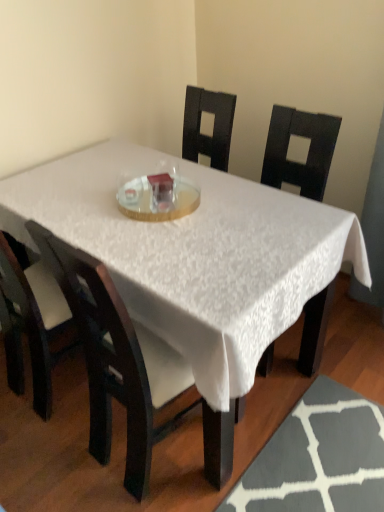
Question: Is matte black chair at center, the first chair when ordered from right to left, next to clear glass plate at center?

Choices:
 (A) yes
 (B) no

Answer: (B)

Question: Considering the relative positions of matte black chair at center, acting as the 2th chair starting from the left, and clear glass plate at center in the image provided, is matte black chair at center, acting as the 2th chair starting from the left, to the right of clear glass plate at center from the viewer's perspective?

Choices:
 (A) no
 (B) yes

Answer: (A)

Question: From a real-world perspective, is matte black chair at center, the first chair when ordered from right to left, physically below clear glass plate at center?

Choices:
 (A) no
 (B) yes

Answer: (B)

Question: Is matte black chair at center, acting as the 2th chair starting from the left, behind clear glass plate at center?

Choices:
 (A) no
 (B) yes

Answer: (A)

Question: Does matte black chair at center, acting as the 2th chair starting from the left, have a greater width compared to clear glass plate at center?

Choices:
 (A) yes
 (B) no

Answer: (A)

Question: Is clear glass plate at center surrounded by matte black chair at center, acting as the 2th chair starting from the left?

Choices:
 (A) yes
 (B) no

Answer: (B)

Question: Is matte black chair at center, the first chair when ordered from right to left, wider than matte black chair at center, positioned as the 2th chair in right-to-left order?

Choices:
 (A) no
 (B) yes

Answer: (B)

Question: Can you confirm if matte black chair at center, acting as the 2th chair starting from the left, is smaller than matte black chair at center, which is the 1th chair from left to right?

Choices:
 (A) no
 (B) yes

Answer: (A)

Question: Is matte black chair at center, acting as the 2th chair starting from the left, far from matte black chair at center, which is the 1th chair from left to right?

Choices:
 (A) no
 (B) yes

Answer: (A)

Question: From the image's perspective, would you say matte black chair at center, acting as the 2th chair starting from the left, is positioned over matte black chair at center, positioned as the 2th chair in right-to-left order?

Choices:
 (A) no
 (B) yes

Answer: (A)

Question: Is matte black chair at center, acting as the 2th chair starting from the left, at the left side of matte black chair at center, positioned as the 2th chair in right-to-left order?

Choices:
 (A) no
 (B) yes

Answer: (A)

Question: Is matte black chair at center, acting as the 2th chair starting from the left, bigger than matte black chair at center, which is the 1th chair from left to right?

Choices:
 (A) no
 (B) yes

Answer: (B)

Question: Does matte black chair at center, positioned as the 2th chair in right-to-left order, contain matte black chair at center, the first chair when ordered from right to left?

Choices:
 (A) no
 (B) yes

Answer: (A)